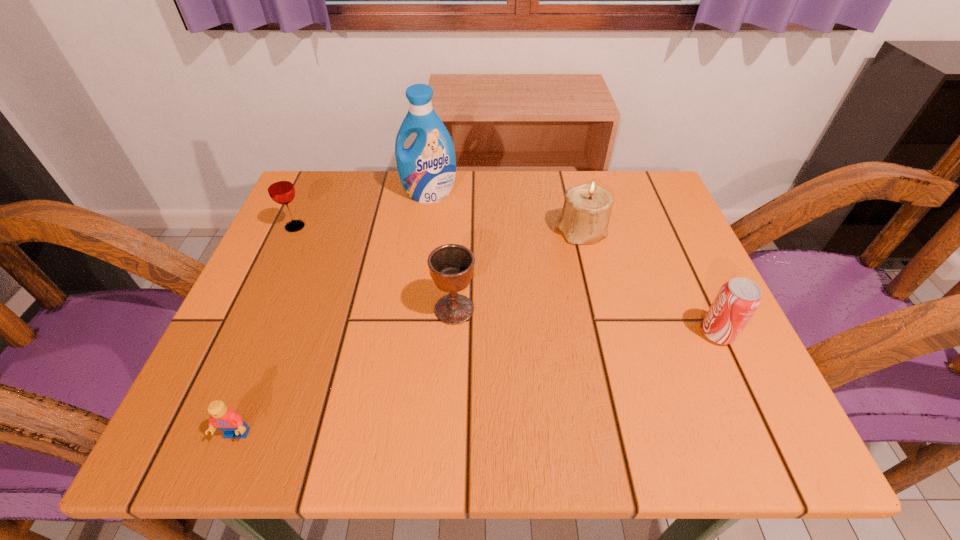
The image size is (960, 540). I want to click on free space that is in between the second object from right to left and the farthest object, so click(505, 213).

Where is `vacant area between the leftmost object and the fifth object from left to right`? The image size is (960, 540). vacant area between the leftmost object and the fifth object from left to right is located at coordinates (438, 230).

You are a GUI agent. You are given a task and a screenshot of the screen. Output one action in this format:
    pyautogui.click(x=<x>, y=<y>)
    Task: Click on the vacant point located between the farthest object and the candle_holder
    This screenshot has height=540, width=960.
    Given the screenshot: What is the action you would take?
    pyautogui.click(x=505, y=213)

The height and width of the screenshot is (540, 960). I want to click on vacant space in between the chalice and the second object from right to left, so (x=517, y=271).

Where is `free space between the leftmost object and the chalice`? The height and width of the screenshot is (540, 960). free space between the leftmost object and the chalice is located at coordinates (374, 268).

Locate an element on the screen. This screenshot has height=540, width=960. free spot between the leftmost object and the detergent is located at coordinates (362, 211).

At what (x,y) coordinates should I click in order to perform the action: click on free space between the fifth object from left to right and the detergent. Please return your answer as a coordinate pair (x, y). Looking at the image, I should click on (505, 213).

Identify the location of vacant space in between the fifth object from left to right and the detergent. (505, 213).

Select which object is the third closest to the chalice. Please provide its 2D coordinates. Your answer should be formatted as a tuple, i.e. [(x, y)], where the tuple contains the x and y coordinates of a point satisfying the conditions above.

[(227, 420)]

Where is `the fifth closest object to the rightmost object`? the fifth closest object to the rightmost object is located at coordinates (281, 190).